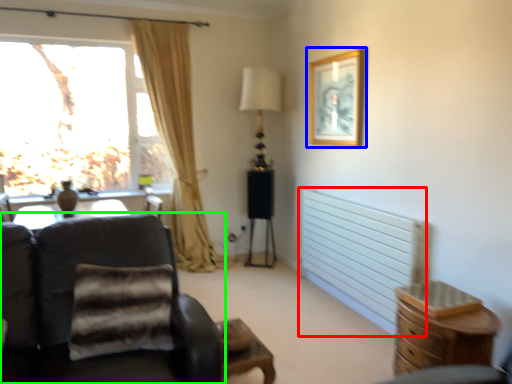
Question: Based on their relative distances, which object is nearer to radiator (highlighted by a red box)? Choose from picture frame (highlighted by a blue box) and chair (highlighted by a green box).

Choices:
 (A) picture frame
 (B) chair

Answer: (A)